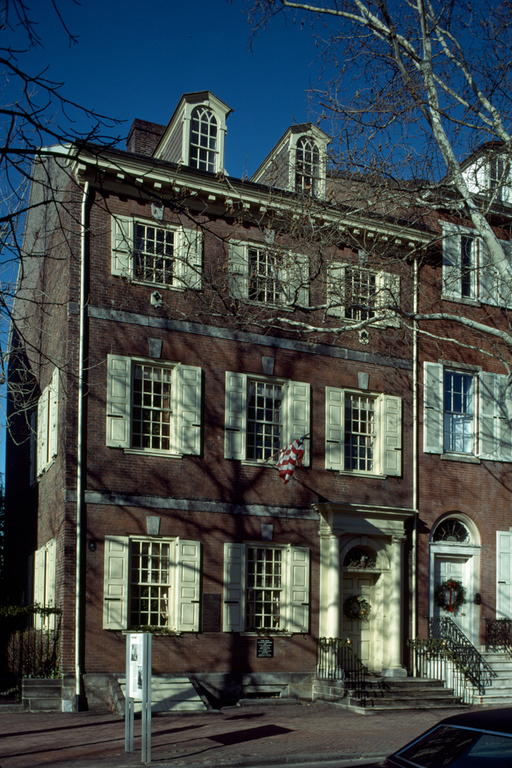
Where is `cellar`? Image resolution: width=512 pixels, height=768 pixels. cellar is located at coordinates (170, 700).